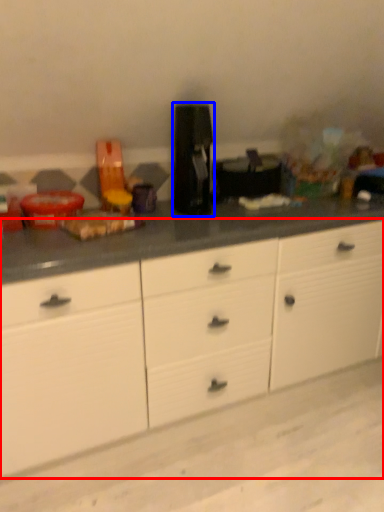
Question: Which of the following is the farthest to the observer, cabinetry (highlighted by a red box) or coffee machine (highlighted by a blue box)?

Choices:
 (A) cabinetry
 (B) coffee machine

Answer: (B)